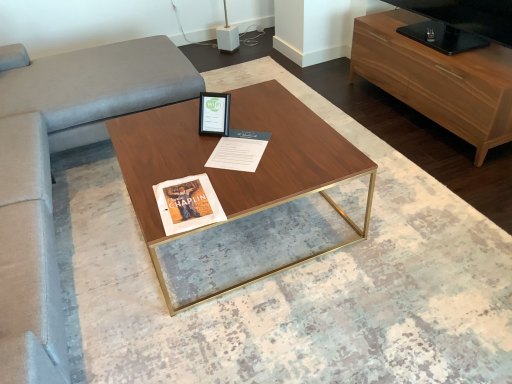
Where is `vacant space to the right of matte black picture frame at center`? vacant space to the right of matte black picture frame at center is located at coordinates (251, 124).